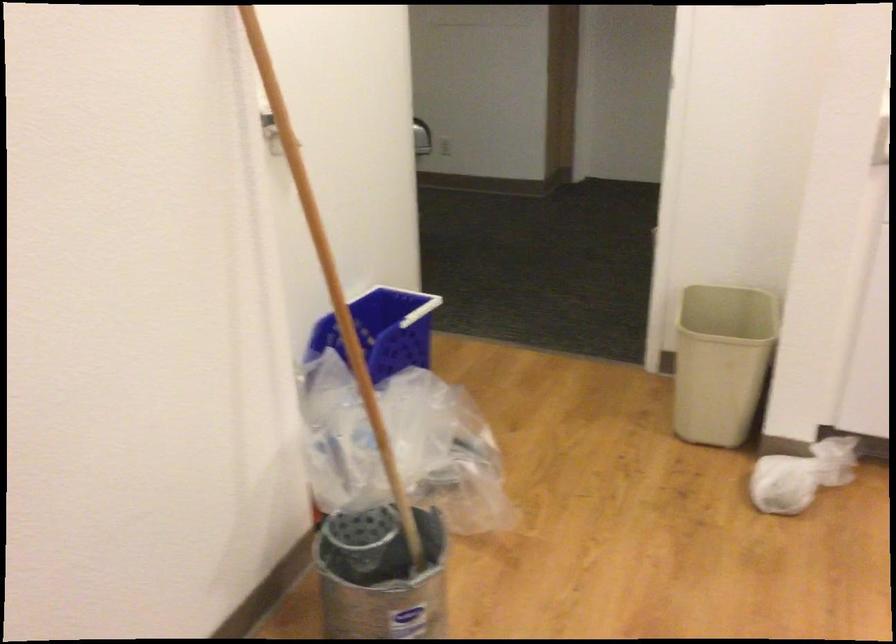
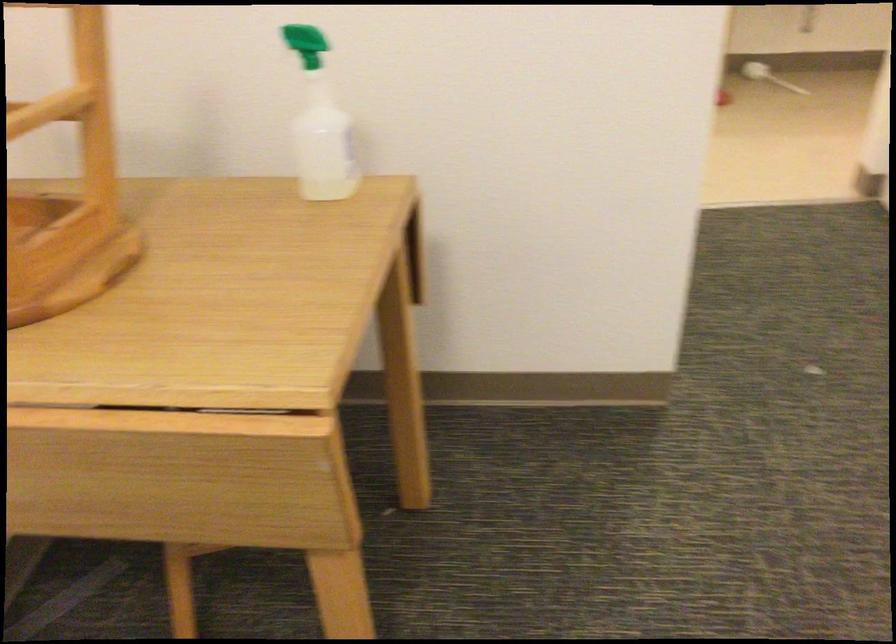
Based on the continuous images, in which direction is the camera rotating?

The camera rotated toward left-down.